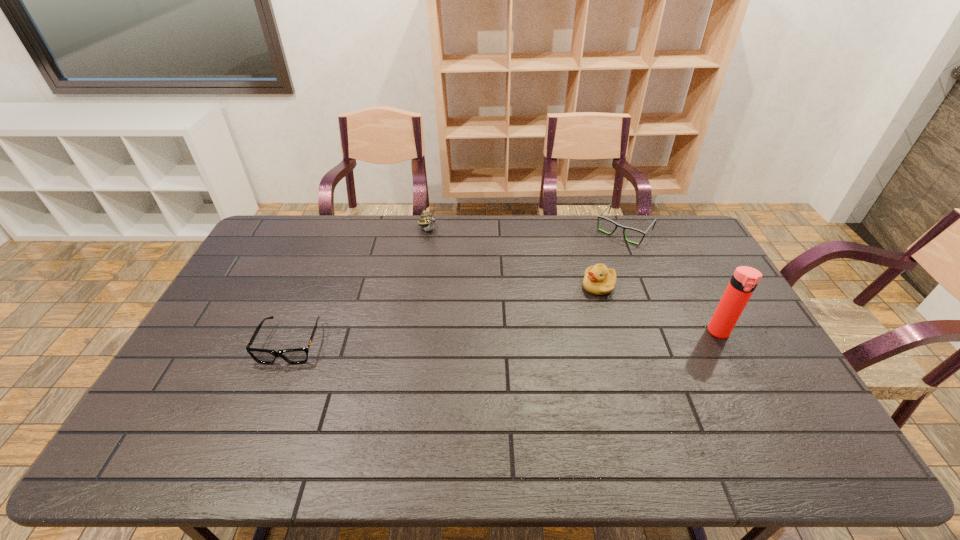
Where is `vacant space on the desktop that is between the sunglasses and the tallest object and is positioned on the front-facing side of the duckling`? vacant space on the desktop that is between the sunglasses and the tallest object and is positioned on the front-facing side of the duckling is located at coordinates (513, 338).

The width and height of the screenshot is (960, 540). I want to click on vacant space on the desktop that is between the leftmost object and the rightmost object and is positioned on the face of the fourth object from right to left, so click(x=509, y=338).

Where is `vacant spot on the desktop that is between the leftmost object and the tallest object and is positioned on the lens of the spectacles`? vacant spot on the desktop that is between the leftmost object and the tallest object and is positioned on the lens of the spectacles is located at coordinates (534, 337).